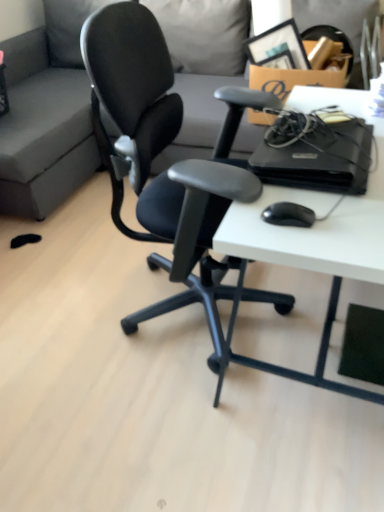
Locate an element on the screen. free area in between black matte mouse at lower right and black plastic computer at right is located at coordinates (x=318, y=201).